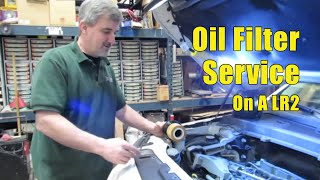
At what (x,y) coordinates should I click in order to perform the action: click on shelve. Please return your answer as a coordinate pair (x, y). This screenshot has height=180, width=320. Looking at the image, I should click on (144, 64).